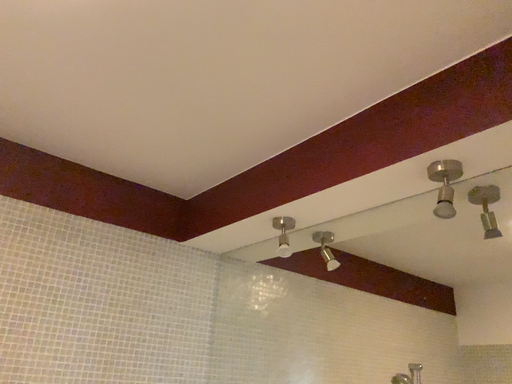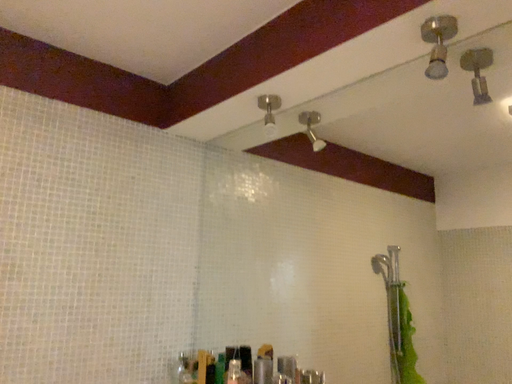
Question: How did the camera likely rotate when shooting the video?

Choices:
 (A) rotated upward
 (B) rotated downward

Answer: (B)